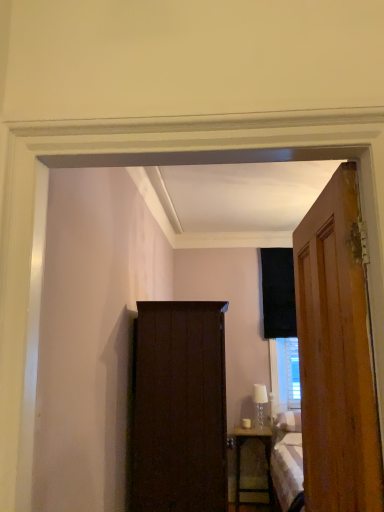
Find the location of `wooden door at right`. wooden door at right is located at coordinates (336, 355).

Describe the element at coordinates (336, 355) in the screenshot. Image resolution: width=384 pixels, height=512 pixels. I see `wooden door at right` at that location.

At what (x,y) coordinates should I click in order to perform the action: click on dark wood cabinet at center. Please return your answer as a coordinate pair (x, y). Looking at the image, I should click on (179, 409).

From a real-world perspective, is dark wood cabinet at center on top of white glass lamp at center?

Correct, in the physical world, dark wood cabinet at center is higher than white glass lamp at center.

From the image's perspective, is dark wood cabinet at center beneath white glass lamp at center?

Actually, dark wood cabinet at center appears above white glass lamp at center in the image.

Consider the image. Based on their sizes in the image, would you say dark wood cabinet at center is bigger or smaller than white glass lamp at center?

Clearly, dark wood cabinet at center is larger in size than white glass lamp at center.

Is wooden nightstand at lower right aimed at wooden door at right?

Yes, wooden nightstand at lower right is facing wooden door at right.

Looking at this image, does wooden nightstand at lower right have a lesser width compared to wooden door at right?

No.

Considering the sizes of objects wooden nightstand at lower right and wooden door at right in the image provided, who is taller, wooden nightstand at lower right or wooden door at right?

Standing taller between the two is wooden door at right.

Relative to wooden nightstand at lower right, is white glass lamp at center in front or behind?

Clearly, white glass lamp at center is behind wooden nightstand at lower right.

Between point (256, 393) and point (269, 438), which one is positioned behind?

The point (256, 393) is more distant.

Could you tell me if white glass lamp at center is turned towards wooden nightstand at lower right?

No.

From the image's perspective, which object appears higher, white glass lamp at center or wooden nightstand at lower right?

From the image's view, white glass lamp at center is above.

In the scene shown: Does white glass lamp at center have a greater height compared to wooden door at right?

In fact, white glass lamp at center may be shorter than wooden door at right.

Is white glass lamp at center looking in the opposite direction of wooden door at right?

No, wooden door at right is not at the back of white glass lamp at center.

Where is `door lying above the white glass lamp at center (from the image's perspective)`? The width and height of the screenshot is (384, 512). door lying above the white glass lamp at center (from the image's perspective) is located at coordinates (336, 355).

From the image's perspective, which is below, white glass lamp at center or wooden door at right?

white glass lamp at center is shown below in the image.

In the image, is wooden door at right positioned in front of or behind wooden nightstand at lower right?

wooden door at right is positioned closer to the viewer than wooden nightstand at lower right.

Is wooden door at right spatially inside wooden nightstand at lower right, or outside of it?

wooden door at right is not enclosed by wooden nightstand at lower right.

From a real-world perspective, is wooden door at right positioned above or below wooden nightstand at lower right?

In terms of real-world spatial position, wooden door at right is above wooden nightstand at lower right.

Considering the sizes of wooden door at right and wooden nightstand at lower right in the image, is wooden door at right wider or thinner than wooden nightstand at lower right?

wooden door at right is thinner than wooden nightstand at lower right.

Considering the sizes of objects wooden nightstand at lower right and dark wood cabinet at center in the image provided, who is thinner, wooden nightstand at lower right or dark wood cabinet at center?

Answer: With smaller width is wooden nightstand at lower right.

Would you say wooden nightstand at lower right is a long distance from dark wood cabinet at center?

Yes.

Between wooden nightstand at lower right and dark wood cabinet at center, which one appears on the left side from the viewer's perspective?

dark wood cabinet at center.

In terms of height, does wooden nightstand at lower right look taller or shorter compared to dark wood cabinet at center?

Clearly, wooden nightstand at lower right is shorter compared to dark wood cabinet at center.

Between dark wood cabinet at center and wooden nightstand at lower right, which one appears on the right side from the viewer's perspective?

Positioned to the right is wooden nightstand at lower right.

Based on the photo, from a real-world perspective, between dark wood cabinet at center and wooden nightstand at lower right, who is vertically higher?

In real-world perspective, dark wood cabinet at center is above.

Is dark wood cabinet at center not within wooden nightstand at lower right?

dark wood cabinet at center lies outside wooden nightstand at lower right's area.

Between point (210, 460) and point (256, 438), which one is positioned behind?

Point (256, 438)

There is a white glass lamp at center. Identify the location of screen door above it (from a real-world perspective). (179, 409).

You are a GUI agent. You are given a task and a screenshot of the screen. Output one action in this format:
    pyautogui.click(x=<x>, y=<y>)
    Task: Click on the nightstand behind the wooden door at right
    This screenshot has width=384, height=512.
    Given the screenshot: What is the action you would take?
    pyautogui.click(x=240, y=461)

Based on their spatial positions, is dark wood cabinet at center or wooden nightstand at lower right closer to white glass lamp at center?

wooden nightstand at lower right is closer to white glass lamp at center.

Considering their positions, is wooden nightstand at lower right positioned further to wooden door at right than dark wood cabinet at center?

wooden nightstand at lower right.

Based on the photo, estimate the real-world distances between objects in this image. Which object is closer to wooden nightstand at lower right, dark wood cabinet at center or white glass lamp at center?

Based on the image, white glass lamp at center appears to be nearer to wooden nightstand at lower right.

Based on their spatial positions, is wooden nightstand at lower right or wooden door at right closer to dark wood cabinet at center?

wooden door at right is closer to dark wood cabinet at center.

Looking at the image, which one is located further to wooden nightstand at lower right, wooden door at right or white glass lamp at center?

wooden door at right lies further to wooden nightstand at lower right than the other object.

From the picture: Based on their spatial positions, is wooden nightstand at lower right or dark wood cabinet at center closer to white glass lamp at center?

wooden nightstand at lower right is positioned closer to the anchor white glass lamp at center.

When comparing their distances from white glass lamp at center, does wooden nightstand at lower right or wooden door at right seem closer?

Among the two, wooden nightstand at lower right is located nearer to white glass lamp at center.

Considering their positions, is wooden door at right positioned further to dark wood cabinet at center than white glass lamp at center?

white glass lamp at center.

Identify the location of screen door between wooden door at right and wooden nightstand at lower right along the z-axis. This screenshot has height=512, width=384. (179, 409).

Identify the location of nightstand between wooden door at right and white glass lamp at center along the z-axis. (240, 461).

At what (x,y) coordinates should I click in order to perform the action: click on screen door located between wooden door at right and white glass lamp at center in the depth direction. Please return your answer as a coordinate pair (x, y). Image resolution: width=384 pixels, height=512 pixels. Looking at the image, I should click on (179, 409).

Identify the location of nightstand between dark wood cabinet at center and white glass lamp at center in the front-back direction. (240, 461).